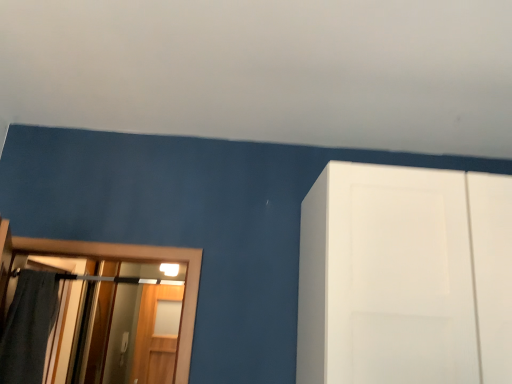
What do you see at coordinates (28, 327) in the screenshot? The height and width of the screenshot is (384, 512). I see `dark gray fabric bath towel at left` at bounding box center [28, 327].

Locate an element on the screen. The height and width of the screenshot is (384, 512). dark gray fabric bath towel at left is located at coordinates (28, 327).

What do you see at coordinates (155, 337) in the screenshot? The image size is (512, 384). I see `wooden screen door at left` at bounding box center [155, 337].

Locate an element on the screen. wooden screen door at left is located at coordinates (155, 337).

Locate an element on the screen. dark gray fabric bath towel at left is located at coordinates (28, 327).

Is wooden screen door at left to the left of dark gray fabric bath towel at left from the viewer's perspective?

Incorrect, wooden screen door at left is not on the left side of dark gray fabric bath towel at left.

Is wooden screen door at left positioned in front of dark gray fabric bath towel at left?

No, it is not.

Between point (151, 313) and point (44, 317), which one is positioned in front?

The point (44, 317) is more forward.

From the image's perspective, is wooden screen door at left above dark gray fabric bath towel at left?

No, from the image's perspective, wooden screen door at left is not on top of dark gray fabric bath towel at left.

From a real-world perspective, relative to dark gray fabric bath towel at left, is wooden screen door at left vertically above or below?

wooden screen door at left is situated lower than dark gray fabric bath towel at left in the real world.

Consider the image. Does wooden screen door at left have a lesser width compared to dark gray fabric bath towel at left?

Yes.

Who is shorter, wooden screen door at left or dark gray fabric bath towel at left?

Standing shorter between the two is dark gray fabric bath towel at left.

Considering the sizes of wooden screen door at left and dark gray fabric bath towel at left in the image, is wooden screen door at left bigger or smaller than dark gray fabric bath towel at left?

In the image, wooden screen door at left appears to be larger than dark gray fabric bath towel at left.

Consider the image. Is dark gray fabric bath towel at left located within wooden screen door at left?

No, dark gray fabric bath towel at left is located outside of wooden screen door at left.

Is wooden screen door at left in contact with dark gray fabric bath towel at left?

They are not placed beside each other.

Is wooden screen door at left oriented away from dark gray fabric bath towel at left?

wooden screen door at left is not turned away from dark gray fabric bath towel at left.

How distant is wooden screen door at left from dark gray fabric bath towel at left?

wooden screen door at left is 2.02 meters away from dark gray fabric bath towel at left.

At what (x,y) coordinates should I click in order to perform the action: click on screen door located behind the dark gray fabric bath towel at left. Please return your answer as a coordinate pair (x, y). The width and height of the screenshot is (512, 384). Looking at the image, I should click on (155, 337).

Considering the positions of objects dark gray fabric bath towel at left and wooden screen door at left in the image provided, who is more to the left, dark gray fabric bath towel at left or wooden screen door at left?

dark gray fabric bath towel at left is more to the left.

Who is more distant, dark gray fabric bath towel at left or wooden screen door at left?

wooden screen door at left is more distant.

Which is closer, (36, 304) or (145, 370)?

Point (36, 304) is positioned closer to the camera compared to point (145, 370).

From the image's perspective, which is below, dark gray fabric bath towel at left or wooden screen door at left?

wooden screen door at left appears lower in the image.

From a real-world perspective, which object stands above the other?

dark gray fabric bath towel at left is physically above.

Between dark gray fabric bath towel at left and wooden screen door at left, which one has smaller width?

Thinner between the two is wooden screen door at left.

Considering the relative sizes of dark gray fabric bath towel at left and wooden screen door at left in the image provided, is dark gray fabric bath towel at left taller than wooden screen door at left?

Incorrect, the height of dark gray fabric bath towel at left is not larger of that of wooden screen door at left.

Can you confirm if dark gray fabric bath towel at left is smaller than wooden screen door at left?

Correct, dark gray fabric bath towel at left occupies less space than wooden screen door at left.

Is dark gray fabric bath towel at left completely or partially outside of wooden screen door at left?

That's correct, dark gray fabric bath towel at left is outside of wooden screen door at left.

In the scene shown: Is dark gray fabric bath towel at left touching wooden screen door at left?

No, dark gray fabric bath towel at left is not in contact with wooden screen door at left.

Is dark gray fabric bath towel at left looking in the opposite direction of wooden screen door at left?

Correct, dark gray fabric bath towel at left is looking away from wooden screen door at left.

How many degrees apart are the facing directions of dark gray fabric bath towel at left and wooden screen door at left?

There is a 7.76-degree angle between the facing directions of dark gray fabric bath towel at left and wooden screen door at left.

Find the location of a particular element. screen door to the right of dark gray fabric bath towel at left is located at coordinates (155, 337).

This screenshot has height=384, width=512. What are the coordinates of `bath towel that is on the left side of wooden screen door at left` in the screenshot? It's located at (28, 327).

The width and height of the screenshot is (512, 384). Identify the location of screen door that appears below the dark gray fabric bath towel at left (from a real-world perspective). (155, 337).